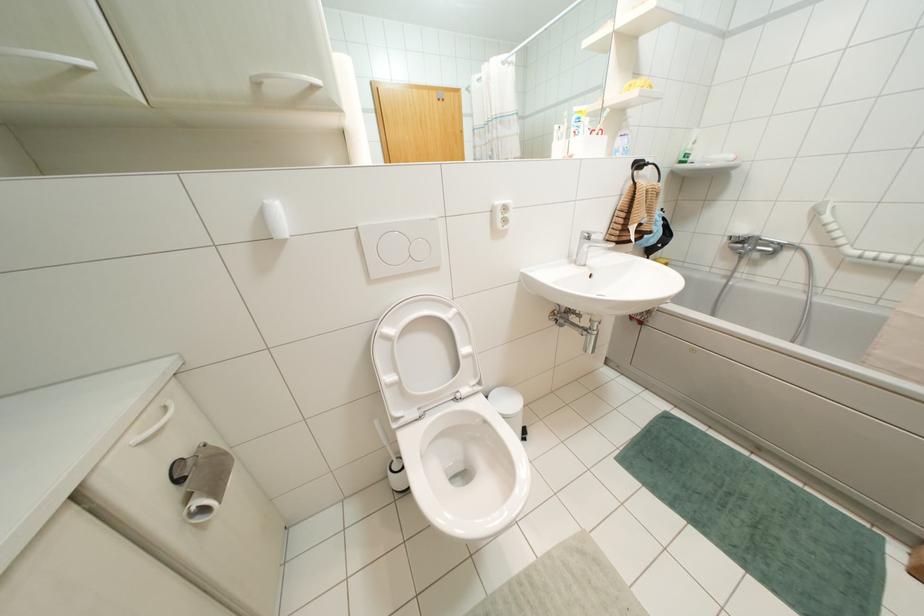
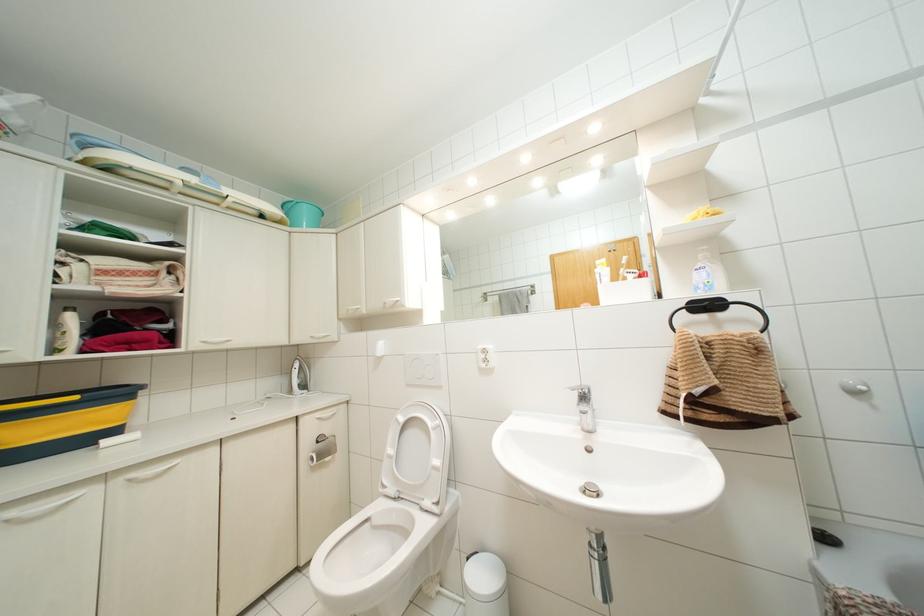
Locate, in the second image, the point that corresponds to [589,238] in the first image.

(584, 395)